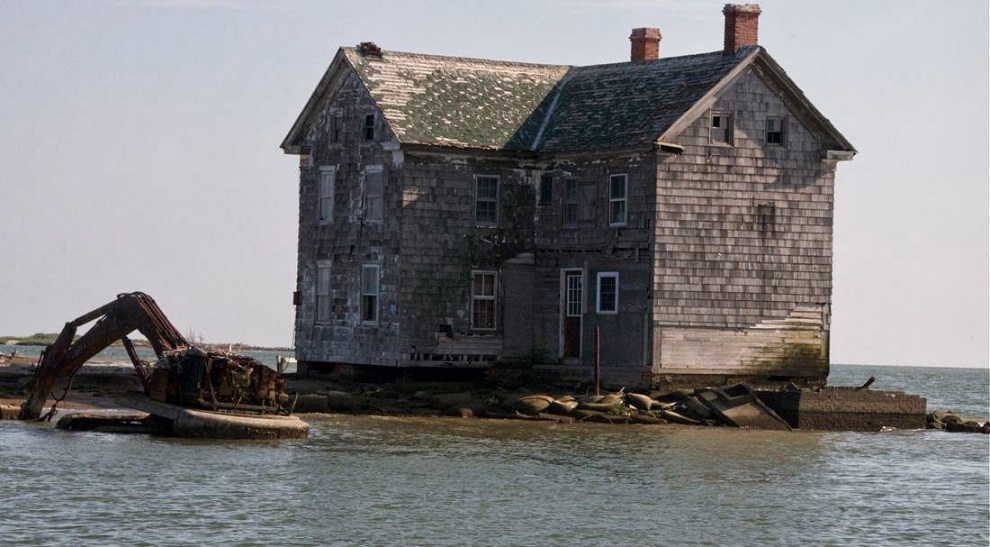
Locate an element on the screen. Image resolution: width=990 pixels, height=547 pixels. windows on door is located at coordinates (572, 284).